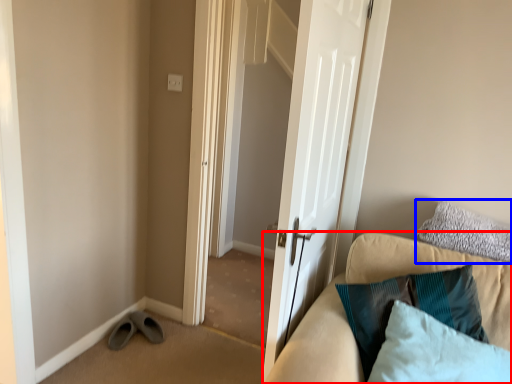
Question: Among these objects, which one is farthest to the camera, studio couch (highlighted by a red box) or pillow (highlighted by a blue box)?

Choices:
 (A) studio couch
 (B) pillow

Answer: (B)